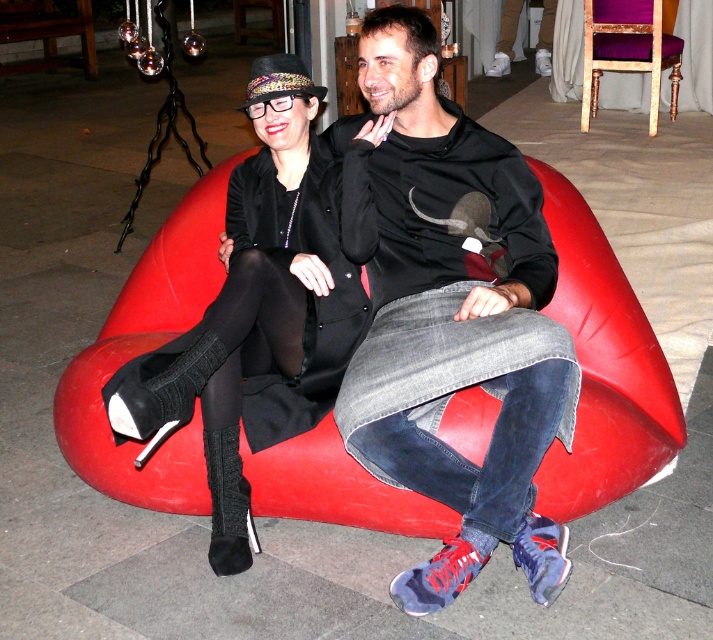
Question: Which of these objects is positioned farthest from the black hoodie at center?

Choices:
 (A) knitted black boot at center
 (B) red fabric bean bag at center

Answer: (B)

Question: Can you confirm if black hoodie at center is positioned above knitted black boot at center?

Choices:
 (A) yes
 (B) no

Answer: (A)

Question: Which of the following is the closest to the observer?

Choices:
 (A) (304, 232)
 (B) (538, 556)

Answer: (B)

Question: Which object appears farthest from the camera in this image?

Choices:
 (A) knitted black boot at center
 (B) black hoodie at center
 (C) red fabric bean bag at center

Answer: (C)

Question: Does black hoodie at center appear over purple velvet chair at upper right?

Choices:
 (A) yes
 (B) no

Answer: (B)

Question: Does red fabric bean bag at center lie behind purple velvet chair at upper right?

Choices:
 (A) no
 (B) yes

Answer: (A)